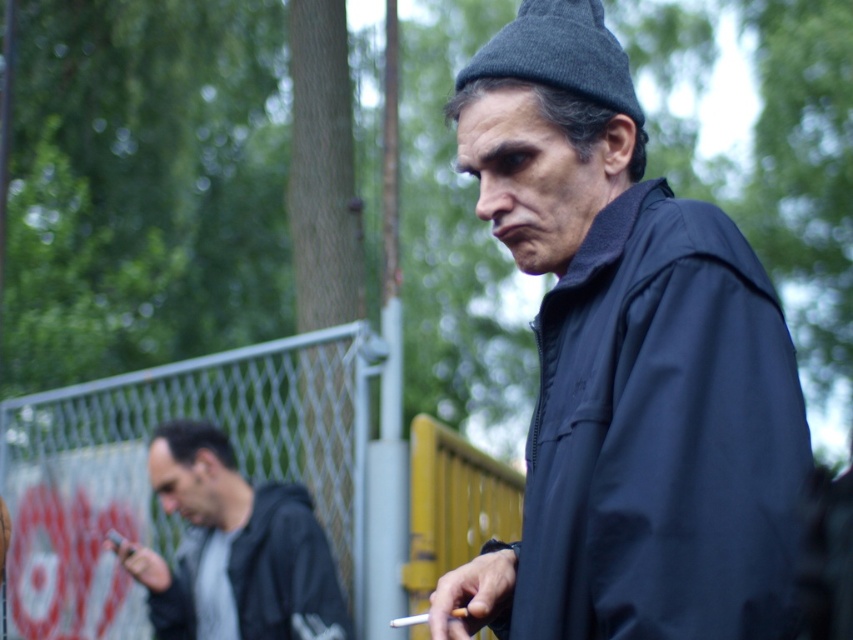
Question: Which point is farther to the camera?

Choices:
 (A) (314, 352)
 (B) (506, 541)
 (C) (405, 625)
 (D) (273, 634)

Answer: (A)

Question: Can you confirm if matte black jacket at center is positioned above white matte cigarette at center?

Choices:
 (A) no
 (B) yes

Answer: (B)

Question: Does dark gray hoodie at left appear over white matte cigarette at center?

Choices:
 (A) no
 (B) yes

Answer: (B)

Question: Is dark gray hoodie at left to the left of white matte cigarette at center from the viewer's perspective?

Choices:
 (A) no
 (B) yes

Answer: (B)

Question: Based on their relative distances, which object is nearer to the dark gray hoodie at left?

Choices:
 (A) metallic chain-link fence at center-left
 (B) matte black jacket at center

Answer: (A)

Question: Among these objects, which one is nearest to the camera?

Choices:
 (A) dark gray hoodie at left
 (B) metallic chain-link fence at center-left

Answer: (A)